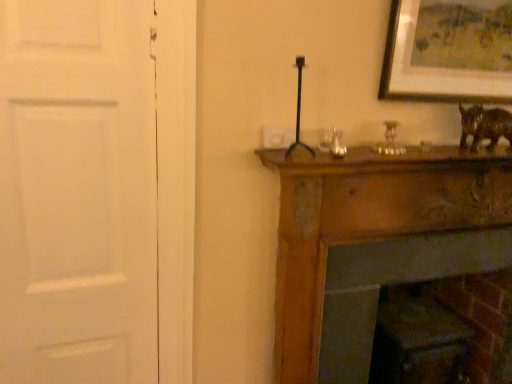
Measure the distance between wooden framed artwork at upper right and camera.

They are 1.33 meters apart.

The height and width of the screenshot is (384, 512). Describe the element at coordinates (402, 270) in the screenshot. I see `brick fireplace at lower right` at that location.

The image size is (512, 384). Find the location of `white matte door at left`. white matte door at left is located at coordinates (77, 192).

At what (x,y) coordinates should I click in order to perform the action: click on wooden fireplace at center. Please return your answer as a coordinate pair (x, y). This screenshot has height=384, width=512. Looking at the image, I should click on (375, 244).

Find the location of a particular element. wooden framed artwork at upper right is located at coordinates (448, 51).

Considering the relative positions of white matte door at left and metallic gold candle holder at upper center in the image provided, is white matte door at left to the left or to the right of metallic gold candle holder at upper center?

In the image, white matte door at left appears on the left side of metallic gold candle holder at upper center.

From the image's perspective, is white matte door at left above metallic gold candle holder at upper center?

Incorrect, from the image's perspective, white matte door at left is lower than metallic gold candle holder at upper center.

From a real-world perspective, is white matte door at left physically located above or below metallic gold candle holder at upper center?

white matte door at left is situated lower than metallic gold candle holder at upper center in the real world.

Which is correct: white matte door at left is inside metallic gold candle holder at upper center, or outside of it?

white matte door at left is spatially situated outside metallic gold candle holder at upper center.

Who is smaller, wooden fireplace at center or metallic gold candle holder at upper center?

Smaller between the two is metallic gold candle holder at upper center.

Locate an element on the screen. Image resolution: width=512 pixels, height=384 pixels. furniture below the metallic gold candle holder at upper center (from the image's perspective) is located at coordinates (375, 244).

Which is more to the left, wooden fireplace at center or metallic gold candle holder at upper center?

metallic gold candle holder at upper center is more to the left.

In the scene shown: From a real-world perspective, who is located higher, wooden fireplace at center or metallic gold candle holder at upper center?

From a 3D spatial view, metallic gold candle holder at upper center is above.

Who is taller, white matte door at left or brick fireplace at lower right?

Standing taller between the two is white matte door at left.

Is white matte door at left directly adjacent to brick fireplace at lower right?

white matte door at left is not next to brick fireplace at lower right, and they're not touching.

The height and width of the screenshot is (384, 512). What are the coordinates of `fireplace located underneath the white matte door at left (from a real-world perspective)` in the screenshot? It's located at (402, 270).

Is brick fireplace at lower right a part of wooden framed artwork at upper right?

No.

Who is more distant, wooden framed artwork at upper right or brick fireplace at lower right?

brick fireplace at lower right.

Is wooden framed artwork at upper right taller than brick fireplace at lower right?

Incorrect, the height of wooden framed artwork at upper right is not larger of that of brick fireplace at lower right.

Is metallic gold candle holder at upper center surrounded by wooden framed artwork at upper right?

Actually, metallic gold candle holder at upper center is outside wooden framed artwork at upper right.

Which object is more forward, wooden framed artwork at upper right or metallic gold candle holder at upper center?

wooden framed artwork at upper right.

Who is taller, wooden framed artwork at upper right or metallic gold candle holder at upper center?

With more height is wooden framed artwork at upper right.

From the image's perspective, which one is positioned lower, wooden framed artwork at upper right or metallic gold candle holder at upper center?

metallic gold candle holder at upper center, from the image's perspective.

Is wooden fireplace at center at the right side of white plastic light switch at upper center?

Yes, wooden fireplace at center is to the right of white plastic light switch at upper center.

Who is taller, wooden fireplace at center or white plastic light switch at upper center?

wooden fireplace at center.

From a real-world perspective, is wooden fireplace at center over white plastic light switch at upper center?

No, from a real-world perspective, wooden fireplace at center is not on top of white plastic light switch at upper center.

Consider the image. Could you tell me if wooden fireplace at center is facing white plastic light switch at upper center?

No, wooden fireplace at center is not turned towards white plastic light switch at upper center.

Which of these two, brown glossy statue at upper right or white plastic light switch at upper center, stands shorter?

With less height is white plastic light switch at upper center.

Is brown glossy statue at upper right facing towards white plastic light switch at upper center?

No, brown glossy statue at upper right is not facing towards white plastic light switch at upper center.

What's the angular difference between brown glossy statue at upper right and white plastic light switch at upper center's facing directions?

The angle between the facing direction of brown glossy statue at upper right and the facing direction of white plastic light switch at upper center is 2.39 degrees.

Who is bigger, brown glossy statue at upper right or white plastic light switch at upper center?

brown glossy statue at upper right.

Where is `door on the left of metallic gold candle holder at upper center`? Image resolution: width=512 pixels, height=384 pixels. door on the left of metallic gold candle holder at upper center is located at coordinates (77, 192).

This screenshot has height=384, width=512. In order to click on furniture beneath the metallic gold candle holder at upper center (from a real-world perspective) in this screenshot , I will do `click(375, 244)`.

Consider the image. Based on their spatial positions, is metallic gold candle holder at upper center or brick fireplace at lower right further from wooden framed artwork at upper right?

Among the two, brick fireplace at lower right is located further to wooden framed artwork at upper right.

When comparing their distances from brown glossy statue at upper right, does white matte door at left or metallic gold candle holder at upper center seem closer?

metallic gold candle holder at upper center is positioned closer to the anchor brown glossy statue at upper right.

Which object lies nearer to the anchor point metallic gold candle holder at upper center, wooden framed artwork at upper right or white matte door at left?

wooden framed artwork at upper right lies closer to metallic gold candle holder at upper center than the other object.

From the image, which object appears to be farther from brick fireplace at lower right, white matte door at left or wooden framed artwork at upper right?

The object further to brick fireplace at lower right is white matte door at left.

Estimate the real-world distances between objects in this image. Which object is closer to brick fireplace at lower right, brown glossy statue at upper right or white plastic light switch at upper center?

brown glossy statue at upper right.

Based on their spatial positions, is white matte door at left or brick fireplace at lower right closer to wooden framed artwork at upper right?

The object closer to wooden framed artwork at upper right is brick fireplace at lower right.

Estimate the real-world distances between objects in this image. Which object is further from wooden framed artwork at upper right, brown glossy statue at upper right or wooden fireplace at center?

wooden fireplace at center lies further to wooden framed artwork at upper right than the other object.

From the image, which object appears to be nearer to wooden framed artwork at upper right, wooden fireplace at center or white plastic light switch at upper center?

Based on the image, wooden fireplace at center appears to be nearer to wooden framed artwork at upper right.

Where is `fireplace between white matte door at left and brown glossy statue at upper right`? fireplace between white matte door at left and brown glossy statue at upper right is located at coordinates (402, 270).

Find the location of `furniture between white matte door at left and wooden framed artwork at upper right from left to right`. furniture between white matte door at left and wooden framed artwork at upper right from left to right is located at coordinates 375,244.

You are a GUI agent. You are given a task and a screenshot of the screen. Output one action in this format:
    pyautogui.click(x=<x>, y=<y>)
    Task: Click on the candle holder between white plastic light switch at upper center and wooden framed artwork at upper right in the horizontal direction
    The image size is (512, 384).
    Given the screenshot: What is the action you would take?
    pyautogui.click(x=390, y=140)

Find the location of a particular element. The image size is (512, 384). light switch between brown glossy statue at upper right and brick fireplace at lower right from top to bottom is located at coordinates (277, 136).